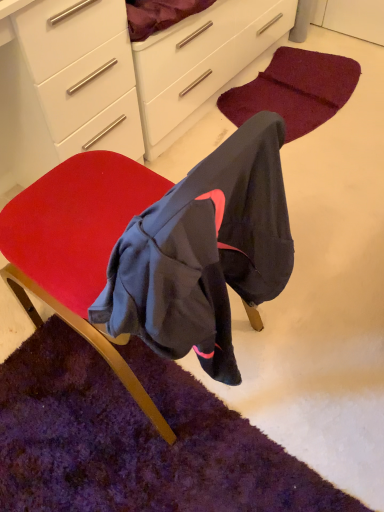
This screenshot has height=512, width=384. What do you see at coordinates (66, 86) in the screenshot?
I see `white glossy chest of drawers at upper left` at bounding box center [66, 86].

I want to click on burgundy carpet at lower center, arranged as the first mat when viewed from the top, so click(295, 90).

Find the location of a particular element. velvet red chair at center is located at coordinates (78, 245).

The image size is (384, 512). I want to click on purple shaggy rug at lower left, which is the first mat from front to back, so click(x=135, y=440).

Find the location of a particular element. This screenshot has width=384, height=512. white glossy chest of drawers at upper left is located at coordinates (66, 86).

Which of these two, velvet red chair at center or white glossy cabinet at upper center, stands shorter?

white glossy cabinet at upper center.

Considering the positions of objects velvet red chair at center and white glossy cabinet at upper center in the image provided, who is more to the right, velvet red chair at center or white glossy cabinet at upper center?

white glossy cabinet at upper center.

Does point (52, 188) appear closer or farther from the camera than point (19, 121)?

Point (52, 188) is closer to the camera than point (19, 121).

Is velvet red chair at center next to white glossy cabinet at upper center and touching it?

No, velvet red chair at center is not in contact with white glossy cabinet at upper center.

Which of these two, white glossy chest of drawers at upper left or purple shaggy rug at lower left, which is the 2th mat in back-to-front order, stands taller?

Standing taller between the two is white glossy chest of drawers at upper left.

How many degrees apart are the facing directions of white glossy chest of drawers at upper left and purple shaggy rug at lower left, acting as the 2th mat starting from the top?

The angle between the facing direction of white glossy chest of drawers at upper left and the facing direction of purple shaggy rug at lower left, acting as the 2th mat starting from the top, is 89.7 degrees.

Considering the relative sizes of white glossy chest of drawers at upper left and purple shaggy rug at lower left, acting as the 2th mat starting from the top, in the image provided, is white glossy chest of drawers at upper left thinner than purple shaggy rug at lower left, acting as the 2th mat starting from the top,?

Yes, white glossy chest of drawers at upper left is thinner than purple shaggy rug at lower left, acting as the 2th mat starting from the top.

How different are the orientations of burgundy carpet at lower center, the 2th mat from the bottom, and velvet red chair at center in degrees?

177 degrees separate the facing orientations of burgundy carpet at lower center, the 2th mat from the bottom, and velvet red chair at center.

Is burgundy carpet at lower center, arranged as the first mat when viewed from the top, positioned beyond the bounds of velvet red chair at center?

Yes, burgundy carpet at lower center, arranged as the first mat when viewed from the top, is located beyond the bounds of velvet red chair at center.

Which is closer, (281, 98) or (217, 203)?

Point (217, 203)

Can you confirm if burgundy carpet at lower center, arranged as the first mat when viewed from the top, is thinner than velvet red chair at center?

Indeed, burgundy carpet at lower center, arranged as the first mat when viewed from the top, has a lesser width compared to velvet red chair at center.

Identify the location of mat lying on the left of burgundy carpet at lower center, arranged as the first mat when viewed from the top. (135, 440).

Is purple shaggy rug at lower left, the 1th mat in the bottom-to-top sequence, positioned in front of burgundy carpet at lower center, arranged as the first mat when viewed from the top?

Yes, it is.

Which is closer to the camera, [160,384] or [223,98]?

The point [160,384] is closer to the camera.

Which object is further away from the camera, white glossy cabinet at upper center or purple shaggy rug at lower left, which is the 2th mat in back-to-front order?

white glossy cabinet at upper center.

Is white glossy cabinet at upper center completely or partially outside of purple shaggy rug at lower left, acting as the 2th mat starting from the top?

Absolutely, white glossy cabinet at upper center is external to purple shaggy rug at lower left, acting as the 2th mat starting from the top.

Considering the positions of points (232, 66) and (187, 502), is point (232, 66) farther from camera compared to point (187, 502)?

Yes, it is.

Can you confirm if white glossy cabinet at upper center is thinner than purple shaggy rug at lower left, the 1th mat in the bottom-to-top sequence?

Yes, white glossy cabinet at upper center is thinner than purple shaggy rug at lower left, the 1th mat in the bottom-to-top sequence.

Considering the sizes of objects purple shaggy rug at lower left, which is the first mat from front to back, and white glossy cabinet at upper center in the image provided, who is taller, purple shaggy rug at lower left, which is the first mat from front to back, or white glossy cabinet at upper center?

white glossy cabinet at upper center is taller.

From the image's perspective, would you say purple shaggy rug at lower left, which is the first mat from front to back, is positioned over white glossy cabinet at upper center?

Incorrect, from the image's perspective, purple shaggy rug at lower left, which is the first mat from front to back, is lower than white glossy cabinet at upper center.

Is point (285, 463) positioned in front of point (160, 71)?

Yes, it is.

Considering the relative sizes of purple shaggy rug at lower left, which is the 2th mat in back-to-front order, and white glossy cabinet at upper center in the image provided, is purple shaggy rug at lower left, which is the 2th mat in back-to-front order, smaller than white glossy cabinet at upper center?

Yes, purple shaggy rug at lower left, which is the 2th mat in back-to-front order, is smaller than white glossy cabinet at upper center.

Is burgundy carpet at lower center, the 2th mat from the bottom, aimed at purple shaggy rug at lower left, which is the 2th mat in back-to-front order?

No, burgundy carpet at lower center, the 2th mat from the bottom, is not turned towards purple shaggy rug at lower left, which is the 2th mat in back-to-front order.

Is burgundy carpet at lower center, the 2th mat from the bottom, not within purple shaggy rug at lower left, which is the 2th mat in back-to-front order?

Absolutely, burgundy carpet at lower center, the 2th mat from the bottom, is external to purple shaggy rug at lower left, which is the 2th mat in back-to-front order.

What are the coordinates of `mat on the right of purple shaggy rug at lower left, which is the first mat from front to back` in the screenshot? It's located at (295, 90).

From a real-world perspective, is burgundy carpet at lower center, which is counted as the second mat, starting from the front, physically located above or below purple shaggy rug at lower left, the 1th mat in the bottom-to-top sequence?

burgundy carpet at lower center, which is counted as the second mat, starting from the front, is above purple shaggy rug at lower left, the 1th mat in the bottom-to-top sequence.

Image resolution: width=384 pixels, height=512 pixels. In order to click on cabinetry located above the velvet red chair at center (from the image's perspective) in this screenshot , I will do [118, 78].

From the white glossy chest of drawers at upper left, count 1st mat to the right and point to it. Please provide its 2D coordinates.

[(135, 440)]

Looking at the image, which one is located further to white glossy chest of drawers at upper left, white glossy cabinet at upper center or velvet red chair at center?

The object further to white glossy chest of drawers at upper left is velvet red chair at center.

Which object lies nearer to the anchor point white glossy chest of drawers at upper left, burgundy carpet at lower center, arranged as the first mat when viewed from the top, or purple shaggy rug at lower left, acting as the 2th mat starting from the top?

purple shaggy rug at lower left, acting as the 2th mat starting from the top, is positioned closer to the anchor white glossy chest of drawers at upper left.

When comparing their distances from white glossy chest of drawers at upper left, does burgundy carpet at lower center, the 2th mat from the bottom, or velvet red chair at center seem further?

burgundy carpet at lower center, the 2th mat from the bottom, is positioned further to the anchor white glossy chest of drawers at upper left.

Based on their spatial positions, is purple shaggy rug at lower left, the 1th mat in the bottom-to-top sequence, or burgundy carpet at lower center, the 2th mat from the bottom, closer to white glossy cabinet at upper center?

burgundy carpet at lower center, the 2th mat from the bottom.

Which object lies nearer to the anchor point white glossy cabinet at upper center, white glossy chest of drawers at upper left or purple shaggy rug at lower left, acting as the 2th mat starting from the top?

Among the two, white glossy chest of drawers at upper left is located nearer to white glossy cabinet at upper center.

Looking at the image, which one is located closer to purple shaggy rug at lower left, which is the 2th mat in back-to-front order, burgundy carpet at lower center, which is counted as the second mat, starting from the front, or white glossy chest of drawers at upper left?

white glossy chest of drawers at upper left is positioned closer to the anchor purple shaggy rug at lower left, which is the 2th mat in back-to-front order.

Considering their positions, is white glossy chest of drawers at upper left positioned further to purple shaggy rug at lower left, which is the first mat from front to back, than white glossy cabinet at upper center?

white glossy cabinet at upper center is further to purple shaggy rug at lower left, which is the first mat from front to back.

Which object lies further to the anchor point velvet red chair at center, white glossy chest of drawers at upper left or white glossy cabinet at upper center?

white glossy cabinet at upper center is further to velvet red chair at center.

Locate an element on the screen. The width and height of the screenshot is (384, 512). cabinetry located between white glossy chest of drawers at upper left and burgundy carpet at lower center, which is counted as the second mat, starting from the front, in the left-right direction is located at coordinates (118, 78).

Locate an element on the screen. chest of drawers between burgundy carpet at lower center, arranged as the first mat when viewed from the top, and purple shaggy rug at lower left, the 1th mat in the bottom-to-top sequence, in the up-down direction is located at coordinates (66, 86).

The height and width of the screenshot is (512, 384). In order to click on the chest of drawers positioned between velvet red chair at center and burgundy carpet at lower center, which is counted as the 1th mat, starting from the back, from near to far in this screenshot , I will do `click(66, 86)`.

You are a GUI agent. You are given a task and a screenshot of the screen. Output one action in this format:
    pyautogui.click(x=<x>, y=<y>)
    Task: Click on the cabinetry located between velvet red chair at center and burgundy carpet at lower center, which is counted as the second mat, starting from the front, in the depth direction
    
    Given the screenshot: What is the action you would take?
    pyautogui.click(x=118, y=78)